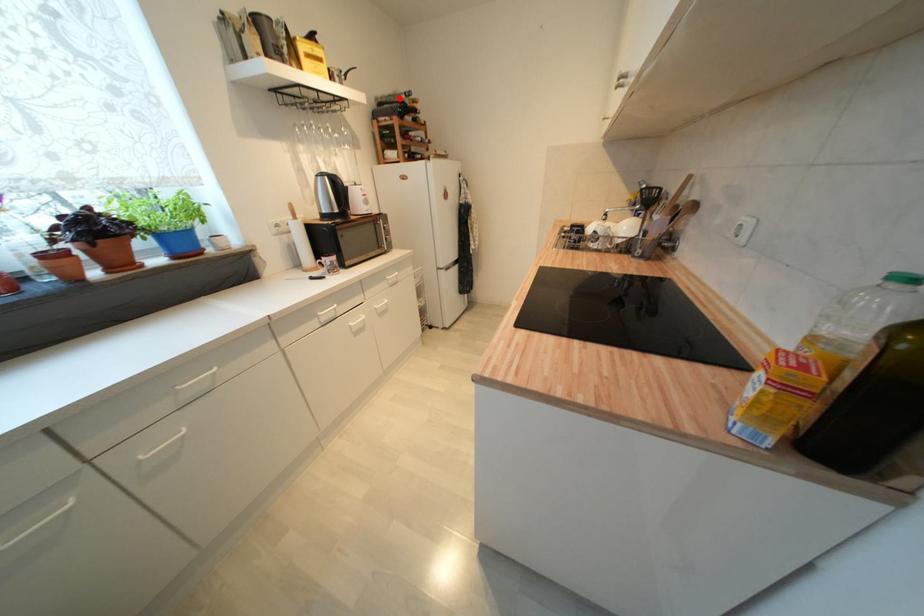
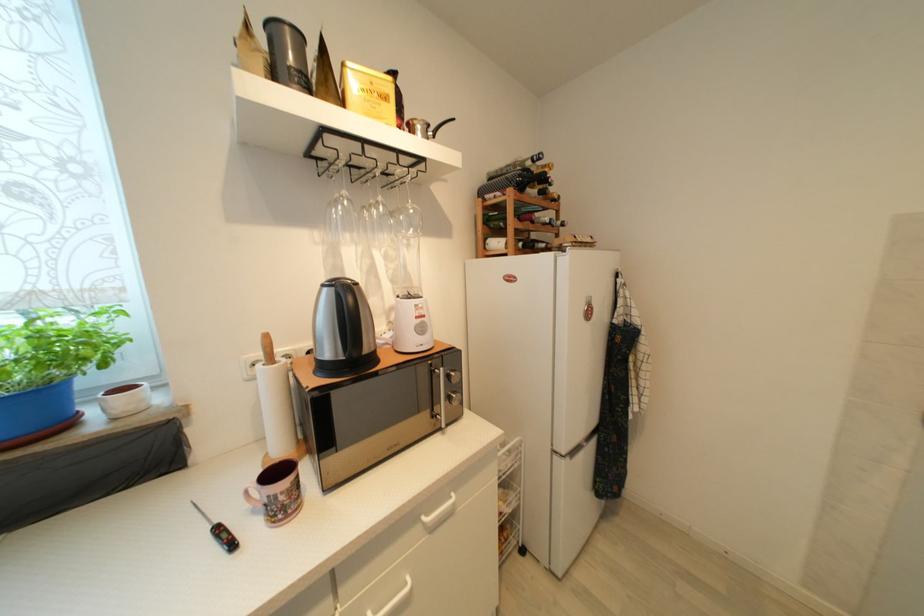
Find the pixel in the second image that matches the highlighted location in the first image.

(518, 166)